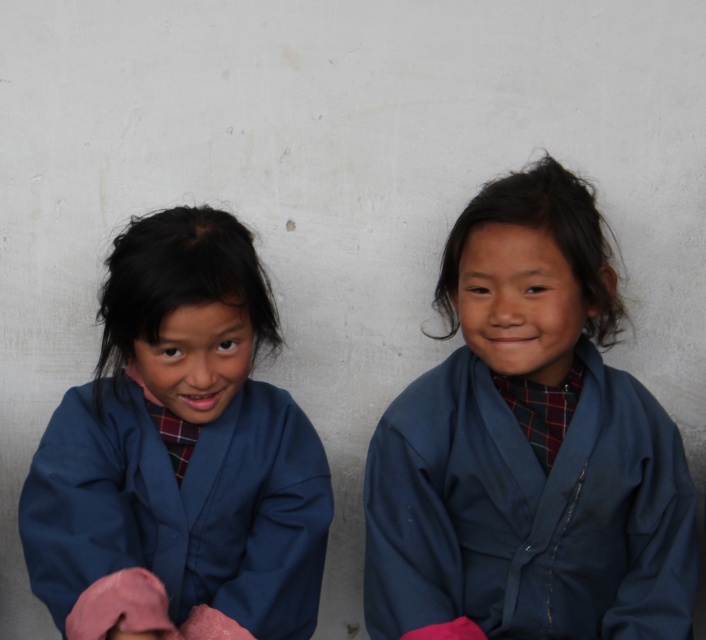
Can you confirm if blue fabric at left is positioned below blue cotton jacket at right?

Incorrect, blue fabric at left is not positioned below blue cotton jacket at right.

Can you confirm if blue fabric at left is wider than blue cotton jacket at right?

No.

Locate an element on the screen. The height and width of the screenshot is (640, 706). blue fabric at left is located at coordinates (179, 454).